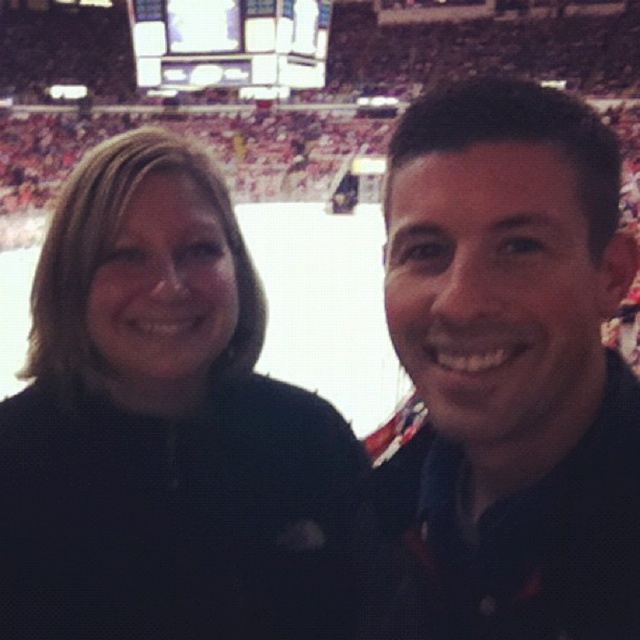
Question: Is black fleece jacket at left below matte black shirt at right?

Choices:
 (A) yes
 (B) no

Answer: (A)

Question: Is black fleece jacket at left to the left of matte black shirt at right from the viewer's perspective?

Choices:
 (A) no
 (B) yes

Answer: (B)

Question: In this image, where is black fleece jacket at left located relative to matte black shirt at right?

Choices:
 (A) above
 (B) below

Answer: (B)

Question: Which point appears closest to the camera in this image?

Choices:
 (A) 500,563
 (B) 93,442

Answer: (A)

Question: Which point is closer to the camera?

Choices:
 (A) (220, 566)
 (B) (552, 388)

Answer: (B)

Question: Which object appears closest to the camera in this image?

Choices:
 (A) matte black shirt at right
 (B) black fleece jacket at left

Answer: (A)